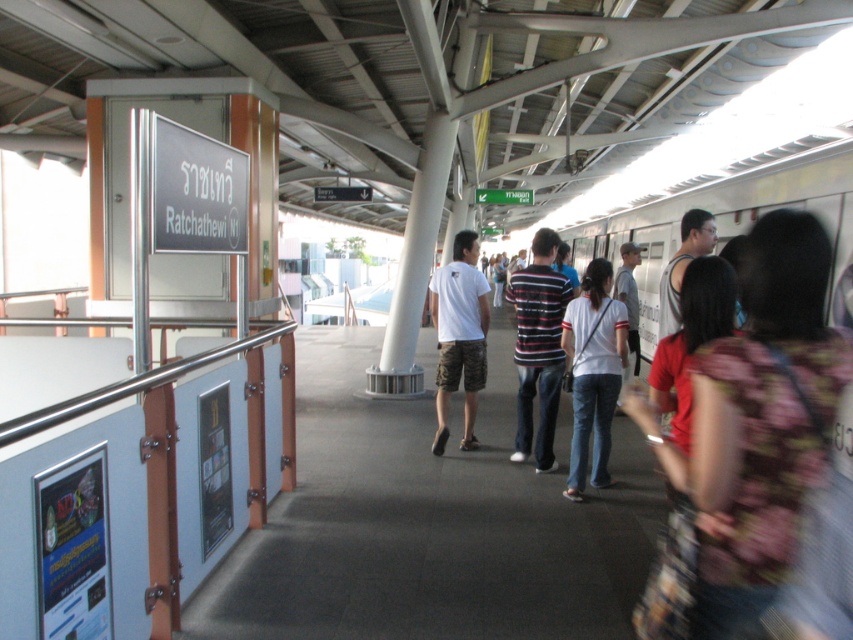
Consider the image. Who is taller, floral fabric dress at center or white cotton shirt at center?

With more height is white cotton shirt at center.

Does point (747, 387) come behind point (596, 451)?

No, it is in front of (596, 451).

Where is `floral fabric dress at center`? floral fabric dress at center is located at coordinates (763, 420).

Can you confirm if floral fabric dress at center is positioned to the right of striped cotton shirt at center?

Correct, you'll find floral fabric dress at center to the right of striped cotton shirt at center.

Does floral fabric dress at center appear over striped cotton shirt at center?

No.

Find the location of a particular element. This screenshot has width=853, height=640. floral fabric dress at center is located at coordinates (763, 420).

Locate an element on the screen. This screenshot has height=640, width=853. floral fabric dress at center is located at coordinates (763, 420).

Between white cotton shirt at center and white cotton t-shirt at center, which one has more height?

white cotton t-shirt at center is taller.

Which is behind, point (585, 435) or point (477, 349)?

Point (477, 349)

Who is more forward, (602, 268) or (471, 392)?

Point (602, 268) is more forward.

Where is `white cotton shirt at center`? white cotton shirt at center is located at coordinates (593, 372).